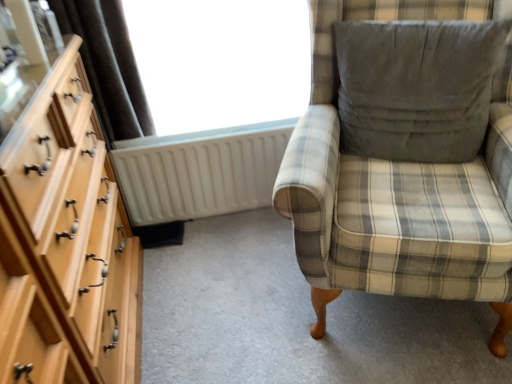
Find the location of a particular element. free spot above gray suede pillow at upper right (from a real-world perspective) is located at coordinates (417, 29).